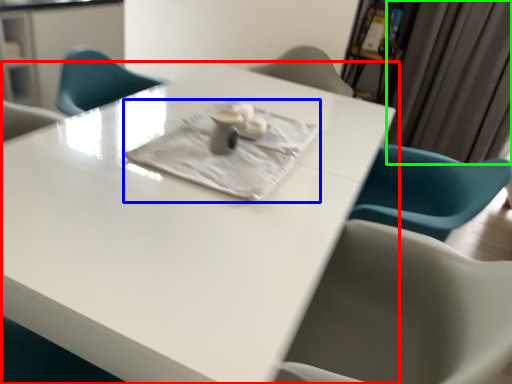
Question: Which is farther away from table (highlighted by a red box)? cloth (highlighted by a blue box) or curtain (highlighted by a green box)?

Choices:
 (A) cloth
 (B) curtain

Answer: (B)